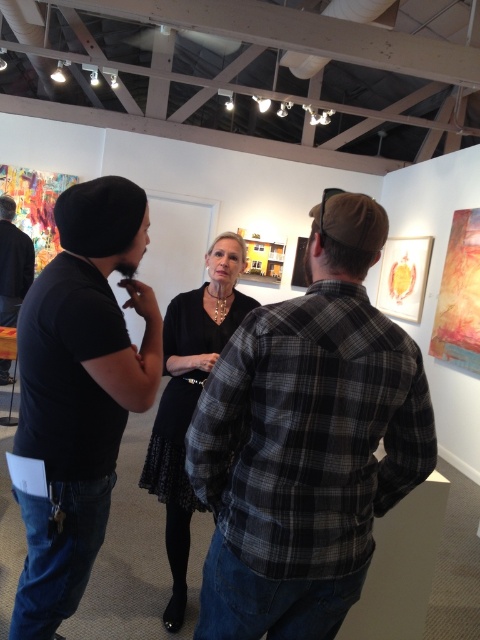
Which is in front, point (359, 531) or point (35, 625)?

Point (359, 531) is more forward.

Who is lower down, plaid flannel shirt at center or black matte t-shirt at left?

black matte t-shirt at left is lower down.

This screenshot has width=480, height=640. Find the location of `plaid flannel shirt at center`. plaid flannel shirt at center is located at coordinates (308, 440).

The height and width of the screenshot is (640, 480). I want to click on plaid flannel shirt at center, so click(x=308, y=440).

Measure the distance between point (204, 300) and camera.

They are 2.27 meters apart.

Between black dress at center and matte black shirt at left, which one is positioned lower?

black dress at center

The height and width of the screenshot is (640, 480). Identify the location of black dress at center. (190, 397).

Can you confirm if plaid flannel shirt at center is positioned to the right of matte black shirt at left?

Yes, plaid flannel shirt at center is to the right of matte black shirt at left.

Does plaid flannel shirt at center have a larger size compared to matte black shirt at left?

Indeed, plaid flannel shirt at center has a larger size compared to matte black shirt at left.

Locate an element on the screen. plaid flannel shirt at center is located at coordinates (308, 440).